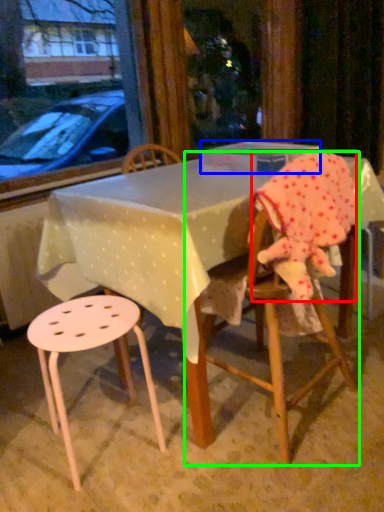
Question: Which is farther away from toddler (highlighted by a red box)? box (highlighted by a blue box) or chair (highlighted by a green box)?

Choices:
 (A) box
 (B) chair

Answer: (A)